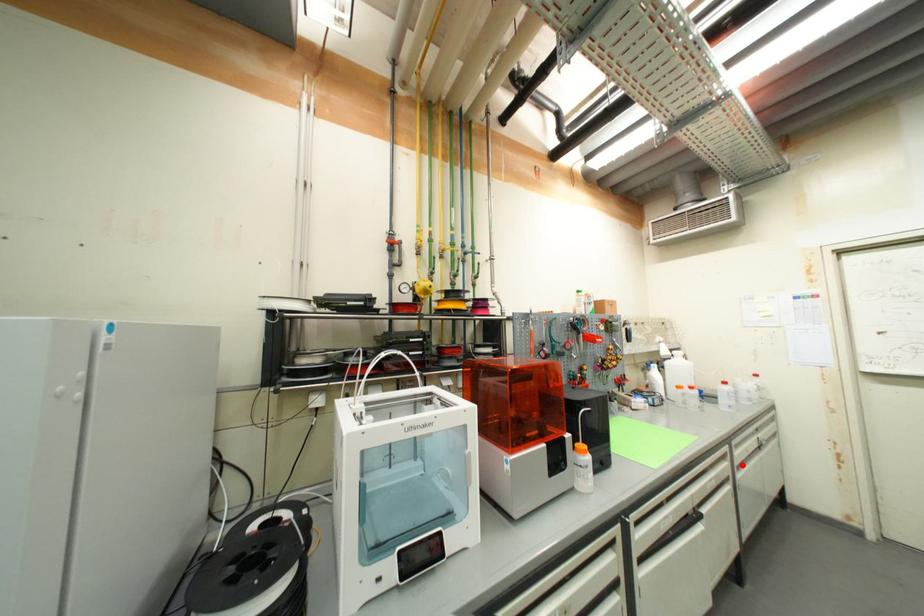
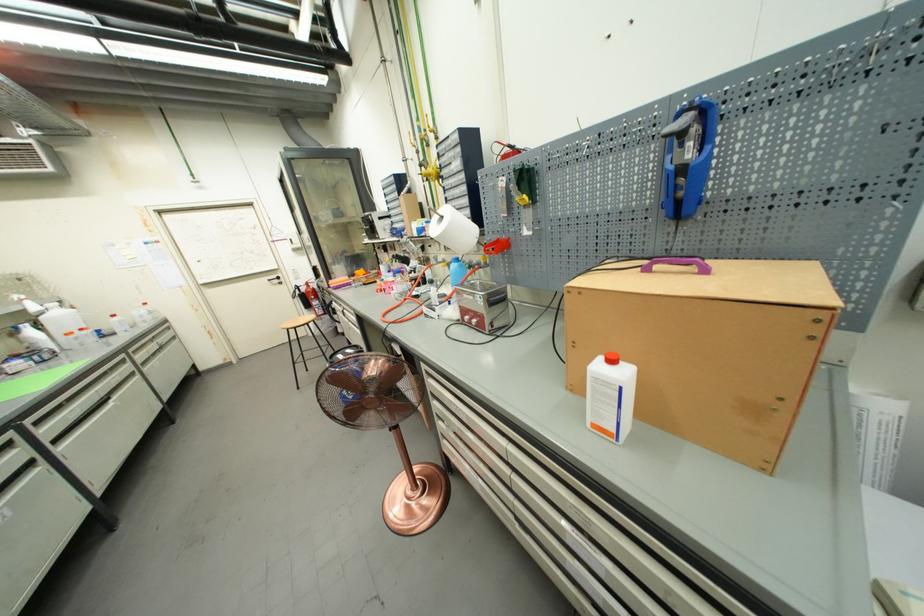
Question: I am providing you with two images of the same scene from different viewpoints. A red point is marked on the first image. At the location where the point appears in image 1, is it still visible in image 2?

Choices:
 (A) Yes
 (B) No

Answer: (A)